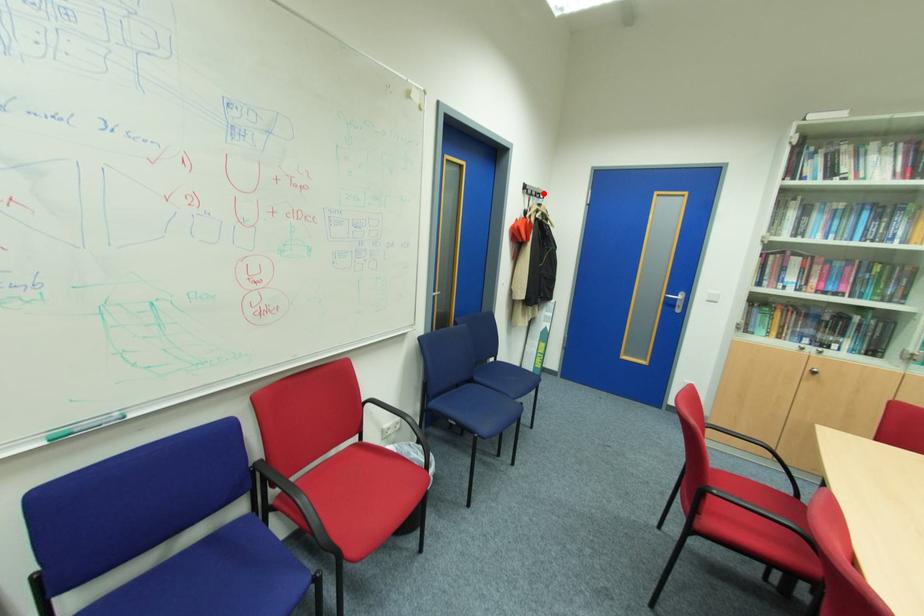
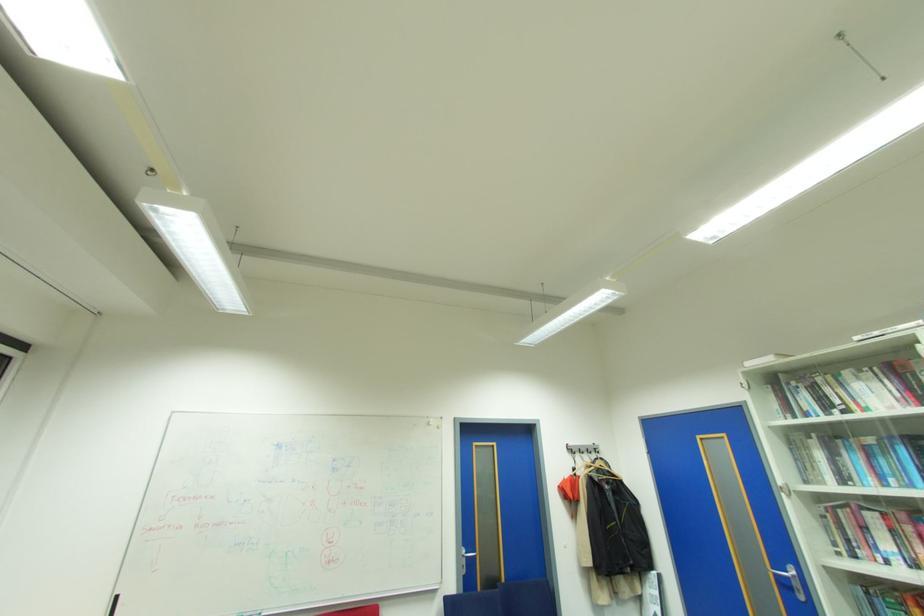
In the second image, find the point that corresponds to the highlighted location in the first image.

(600, 448)